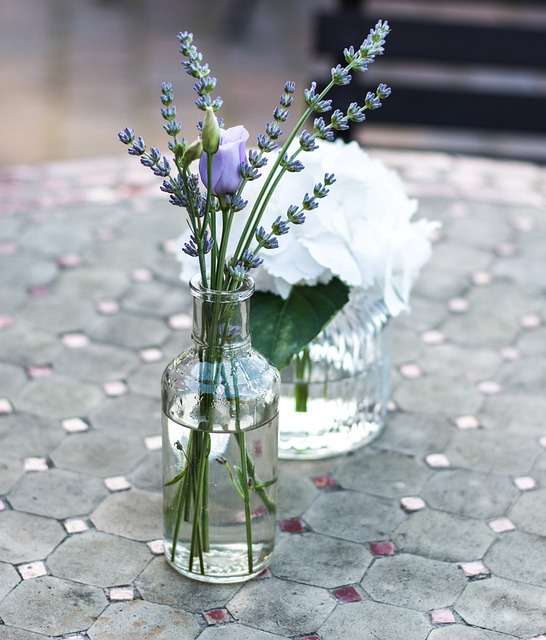
The height and width of the screenshot is (640, 546). In order to click on short squat vase in this screenshot , I will do `click(221, 620)`, `click(288, 532)`, `click(318, 493)`, `click(387, 550)`, `click(342, 592)`, `click(314, 637)`, `click(328, 438)`.